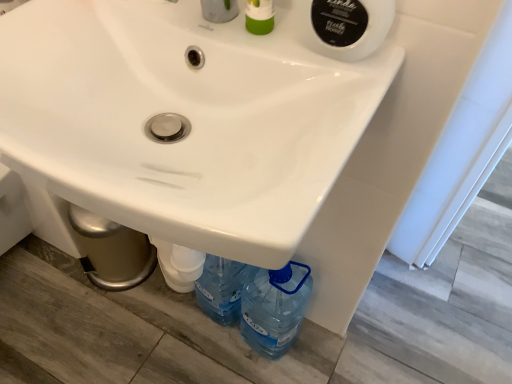
Question: Does white glossy sink at center have a greater height compared to green plastic soap dispenser at upper center?

Choices:
 (A) no
 (B) yes

Answer: (A)

Question: From the image's perspective, is white glossy sink at center over green plastic soap dispenser at upper center?

Choices:
 (A) no
 (B) yes

Answer: (A)

Question: Is white glossy sink at center oriented away from green plastic soap dispenser at upper center?

Choices:
 (A) no
 (B) yes

Answer: (A)

Question: Is white glossy sink at center further to the viewer compared to green plastic soap dispenser at upper center?

Choices:
 (A) no
 (B) yes

Answer: (A)

Question: Is white glossy sink at center not close to green plastic soap dispenser at upper center?

Choices:
 (A) no
 (B) yes

Answer: (A)

Question: In terms of width, does white glossy sink at center look wider or thinner when compared to green plastic soap dispenser at upper center?

Choices:
 (A) thin
 (B) wide

Answer: (B)

Question: Based on their sizes in the image, would you say white glossy sink at center is bigger or smaller than green plastic soap dispenser at upper center?

Choices:
 (A) big
 (B) small

Answer: (A)

Question: From the image's perspective, is white glossy sink at center above or below green plastic soap dispenser at upper center?

Choices:
 (A) above
 (B) below

Answer: (B)

Question: Relative to green plastic soap dispenser at upper center, is white glossy sink at center in front or behind?

Choices:
 (A) behind
 (B) front

Answer: (B)

Question: Is green plastic soap dispenser at upper center spatially inside white plastic pipe at lower center, or outside of it?

Choices:
 (A) inside
 (B) outside

Answer: (B)

Question: Is green plastic soap dispenser at upper center wider or thinner than white plastic pipe at lower center?

Choices:
 (A) wide
 (B) thin

Answer: (B)

Question: From a real-world perspective, is green plastic soap dispenser at upper center above or below white plastic pipe at lower center?

Choices:
 (A) above
 (B) below

Answer: (A)

Question: Would you say green plastic soap dispenser at upper center is to the left or to the right of white plastic pipe at lower center in the picture?

Choices:
 (A) left
 (B) right

Answer: (B)

Question: Which is correct: white plastic pipe at lower center is inside white glossy sink at center, or outside of it?

Choices:
 (A) outside
 (B) inside

Answer: (A)

Question: From the image's perspective, is white plastic pipe at lower center above or below white glossy sink at center?

Choices:
 (A) below
 (B) above

Answer: (A)